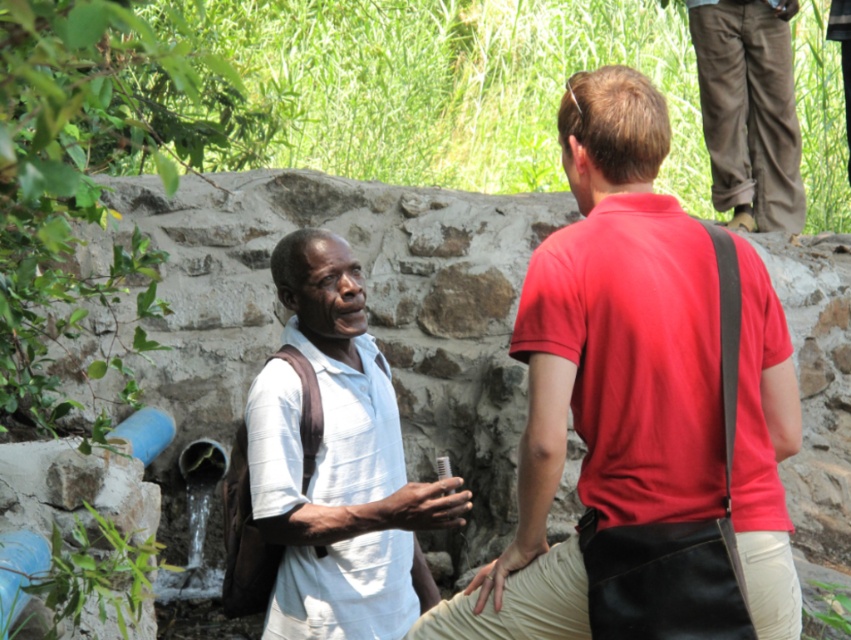
Can you confirm if matte red shirt at center is shorter than khaki pants at upper right?

In fact, matte red shirt at center may be taller than khaki pants at upper right.

Between matte red shirt at center and khaki pants at upper right, which one is positioned lower?

Positioned lower is matte red shirt at center.

Is point (535, 500) in front of point (751, 83)?

Yes.

Where is `matte red shirt at center`? This screenshot has height=640, width=851. matte red shirt at center is located at coordinates (604, 365).

How far apart are white cotton shirt at center and khaki pants at upper right?

4.44 meters

Is white cotton shirt at center thinner than khaki pants at upper right?

Yes.

Does point (400, 596) lie behind point (770, 164)?

No, it is not.

Locate an element on the screen. white cotton shirt at center is located at coordinates (338, 464).

Is the position of matte red shirt at center less distant than that of white cotton shirt at center?

Yes, it is in front of white cotton shirt at center.

From the picture: Can you confirm if matte red shirt at center is positioned to the left of white cotton shirt at center?

In fact, matte red shirt at center is to the right of white cotton shirt at center.

Is point (601, 209) positioned before point (281, 524)?

Yes, it is in front of point (281, 524).

The height and width of the screenshot is (640, 851). In order to click on matte red shirt at center in this screenshot , I will do `click(604, 365)`.